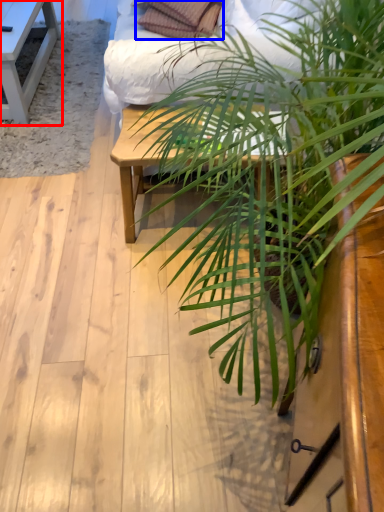
Question: Which object appears farthest to the camera in this image, table (highlighted by a red box) or pillow (highlighted by a blue box)?

Choices:
 (A) table
 (B) pillow

Answer: (A)